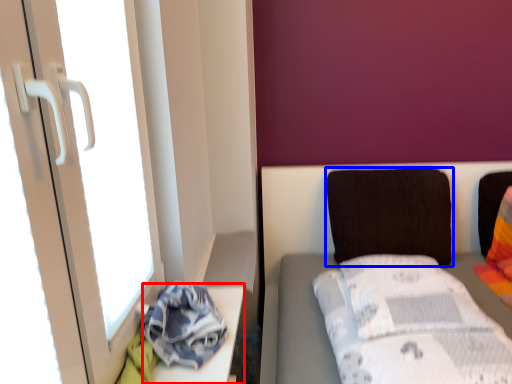
Question: Which point is closer to the camera, table (highlighted by a red box) or pillow (highlighted by a blue box)?

Choices:
 (A) table
 (B) pillow

Answer: (A)